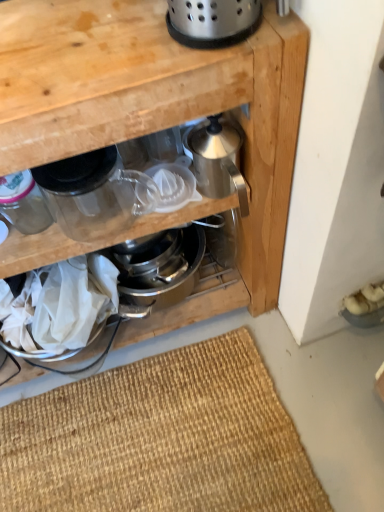
Question: Considering the relative sizes of polished stainless steel colander at upper center, which ranks as the third appliance in left-to-right order, and transparent glass jar at upper left in the image provided, is polished stainless steel colander at upper center, which ranks as the third appliance in left-to-right order, shorter than transparent glass jar at upper left?

Choices:
 (A) yes
 (B) no

Answer: (B)

Question: Is polished stainless steel colander at upper center, which ranks as the third appliance in left-to-right order, behind transparent glass jar at upper left?

Choices:
 (A) yes
 (B) no

Answer: (B)

Question: Can you confirm if polished stainless steel colander at upper center, marked as the second appliance in a right-to-left arrangement, is wider than transparent glass jar at upper left?

Choices:
 (A) no
 (B) yes

Answer: (A)

Question: From a real-world perspective, is polished stainless steel colander at upper center, which ranks as the third appliance in left-to-right order, physically above transparent glass jar at upper left?

Choices:
 (A) yes
 (B) no

Answer: (A)

Question: Is polished stainless steel colander at upper center, which ranks as the third appliance in left-to-right order, positioned in front of transparent glass jar at upper left?

Choices:
 (A) yes
 (B) no

Answer: (A)

Question: Considering the relative sizes of polished stainless steel colander at upper center, marked as the second appliance in a right-to-left arrangement, and transparent glass jar at upper left in the image provided, is polished stainless steel colander at upper center, marked as the second appliance in a right-to-left arrangement, smaller than transparent glass jar at upper left?

Choices:
 (A) no
 (B) yes

Answer: (B)

Question: From a real-world perspective, is stainless steel kettle at center, which ranks as the 4th appliance in left-to-right order, physically below transparent glass jar at upper left?

Choices:
 (A) yes
 (B) no

Answer: (B)

Question: From the image's perspective, is stainless steel kettle at center, which ranks as the 4th appliance in left-to-right order, beneath transparent glass jar at upper left?

Choices:
 (A) no
 (B) yes

Answer: (A)

Question: Does stainless steel kettle at center, which ranks as the 4th appliance in left-to-right order, touch transparent glass jar at upper left?

Choices:
 (A) yes
 (B) no

Answer: (B)

Question: Is stainless steel kettle at center, which ranks as the 4th appliance in left-to-right order, taller than transparent glass jar at upper left?

Choices:
 (A) no
 (B) yes

Answer: (B)

Question: Is stainless steel kettle at center, the 1th appliance viewed from the right, outside transparent glass jar at upper left?

Choices:
 (A) no
 (B) yes

Answer: (B)

Question: Is stainless steel kettle at center, the 1th appliance viewed from the right, further to camera compared to transparent glass jar at upper left?

Choices:
 (A) yes
 (B) no

Answer: (A)

Question: Is polished stainless steel colander at upper center, marked as the second appliance in a right-to-left arrangement, completely or partially inside transparent plastic juicer at center, which is counted as the 3th appliance, starting from the right?

Choices:
 (A) yes
 (B) no

Answer: (B)